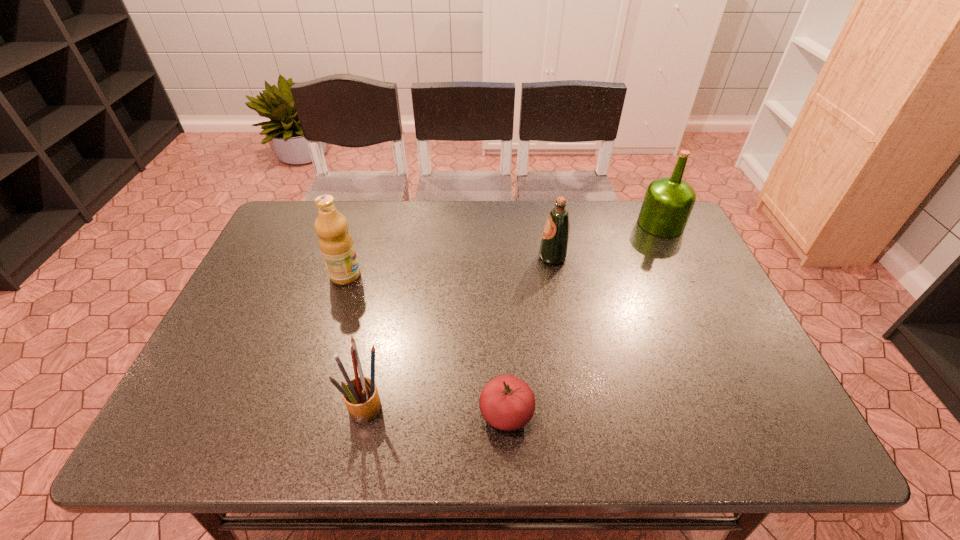
The image size is (960, 540). Find the location of `vacant space in between the third object from right to left and the leftmost object`. vacant space in between the third object from right to left and the leftmost object is located at coordinates (426, 345).

Find the location of a particular element. vacant area that lies between the second object from left to right and the farthest olive oil is located at coordinates (513, 316).

Identify the location of free space between the leftmost olive oil and the shortest object. The height and width of the screenshot is (540, 960). (426, 345).

Image resolution: width=960 pixels, height=540 pixels. Identify the location of vacant area that lies between the second olive oil from right to left and the rightmost olive oil. (607, 240).

You are a GUI agent. You are given a task and a screenshot of the screen. Output one action in this format:
    pyautogui.click(x=<x>, y=<y>)
    Task: Click on the free space between the third shortest object and the third object from left to right
    The image size is (960, 540).
    Given the screenshot: What is the action you would take?
    pyautogui.click(x=530, y=335)

Locate an element on the screen. Image resolution: width=960 pixels, height=540 pixels. blank region between the leftmost object and the second object from left to right is located at coordinates (355, 342).

You are a GUI agent. You are given a task and a screenshot of the screen. Output one action in this format:
    pyautogui.click(x=<x>, y=<y>)
    Task: Click on the third closest object to the leftmost olive oil
    
    Given the screenshot: What is the action you would take?
    pyautogui.click(x=554, y=247)

Identify which object is the second closest to the shortest olive oil. Please provide its 2D coordinates. Your answer should be formatted as a tuple, i.e. [(x, y)], where the tuple contains the x and y coordinates of a point satisfying the conditions above.

[(507, 403)]

Find the location of a particular element. The height and width of the screenshot is (540, 960). olive oil that is the third closest to the tomato is located at coordinates (668, 201).

Find the location of `olive oil that is the closest to the shortest olive oil`. olive oil that is the closest to the shortest olive oil is located at coordinates (668, 201).